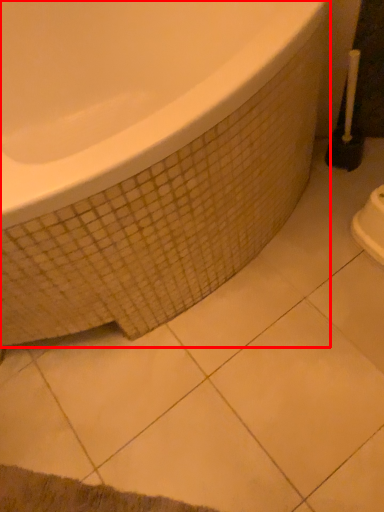
Question: From the image, what is the correct spatial relationship of bathtub (annotated by the red box) in relation to brush?

Choices:
 (A) left
 (B) right

Answer: (A)